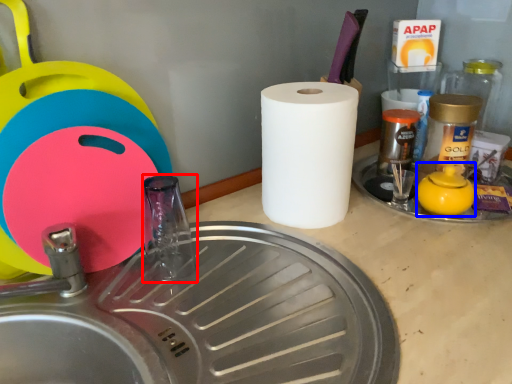
Question: Among these objects, which one is nearest to the camera, faucet (highlighted by a red box) or tea pot (highlighted by a blue box)?

Choices:
 (A) faucet
 (B) tea pot

Answer: (A)